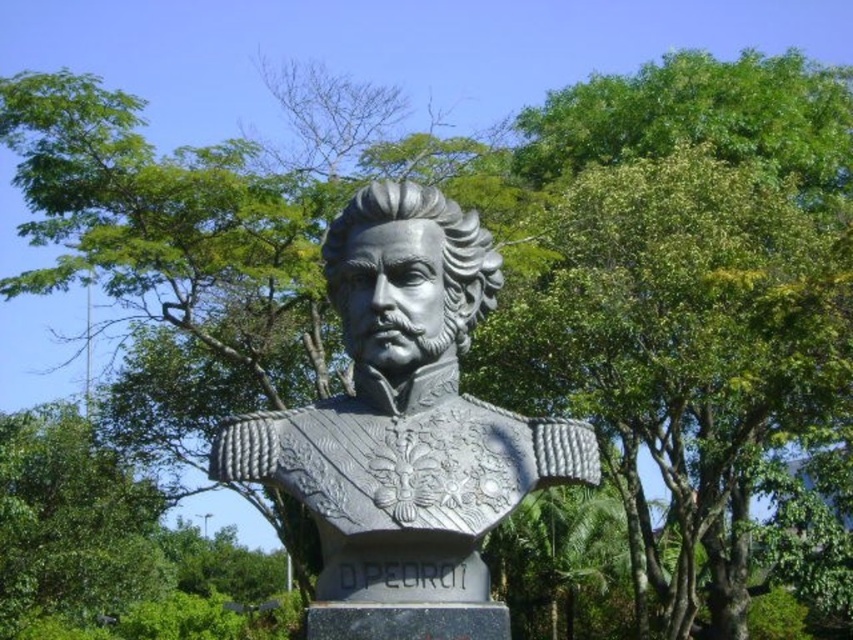
Consider the image. You are standing in a park and see both the polished bronze bust at center and the green leafy tree at center. Which object is positioned to the right of the other?

The polished bronze bust at center is to the right of the green leafy tree at center.

You are a tour guide pointing out landmarks in the park. A visitor asks you to describe the exact location of the polished bronze bust at center. What coordinates would you provide?

The polished bronze bust at center is located at coordinates point (405, 412).